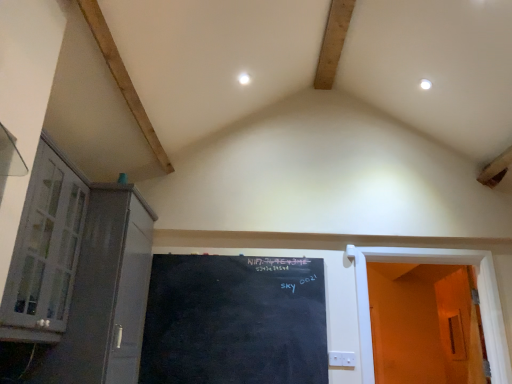
Question: Is orange matte door at right, the 1th door viewed from the right, taller than white glass cabinet at left?

Choices:
 (A) yes
 (B) no

Answer: (B)

Question: Is orange matte door at right, the 1th door viewed from the right, bigger than white glass cabinet at left?

Choices:
 (A) no
 (B) yes

Answer: (A)

Question: Can you confirm if orange matte door at right, the second door from the left, is positioned to the left of white glass cabinet at left?

Choices:
 (A) no
 (B) yes

Answer: (A)

Question: From a real-world perspective, is orange matte door at right, the 1th door viewed from the right, on top of white glass cabinet at left?

Choices:
 (A) no
 (B) yes

Answer: (A)

Question: Is orange matte door at right, the 1th door viewed from the right, oriented away from white glass cabinet at left?

Choices:
 (A) yes
 (B) no

Answer: (B)

Question: Does black chalkboard at center have a larger size compared to matte gray cabinet at left?

Choices:
 (A) no
 (B) yes

Answer: (A)

Question: Can you confirm if black chalkboard at center is smaller than matte gray cabinet at left?

Choices:
 (A) no
 (B) yes

Answer: (B)

Question: Is black chalkboard at center not inside matte gray cabinet at left?

Choices:
 (A) no
 (B) yes

Answer: (B)

Question: Is the position of black chalkboard at center less distant than that of matte gray cabinet at left?

Choices:
 (A) yes
 (B) no

Answer: (B)

Question: Considering the relative sizes of black chalkboard at center and matte gray cabinet at left in the image provided, is black chalkboard at center taller than matte gray cabinet at left?

Choices:
 (A) no
 (B) yes

Answer: (A)

Question: From a real-world perspective, is black chalkboard at center positioned over matte gray cabinet at left based on gravity?

Choices:
 (A) no
 (B) yes

Answer: (A)

Question: From the image's perspective, is white glass cabinet at left under black chalkboard at center?

Choices:
 (A) yes
 (B) no

Answer: (B)